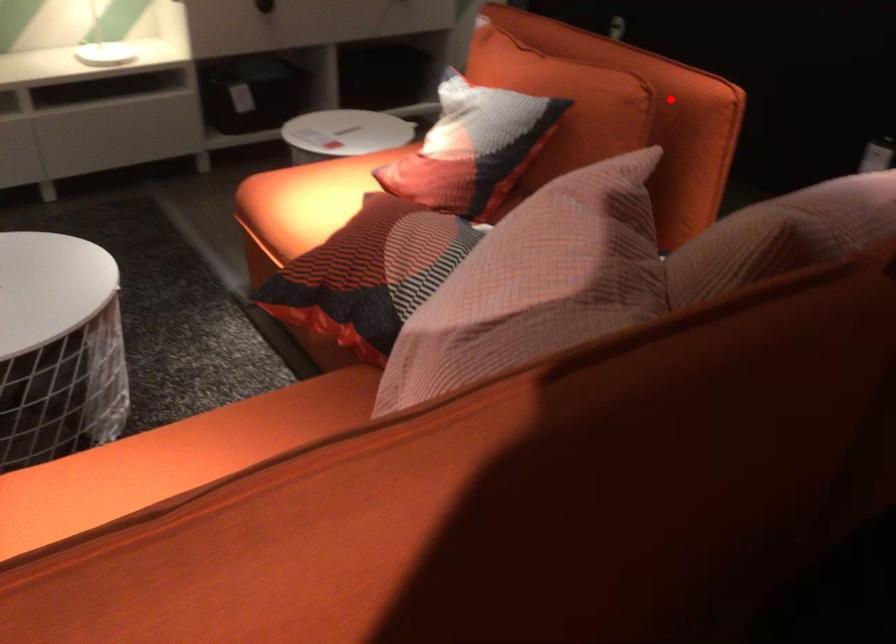
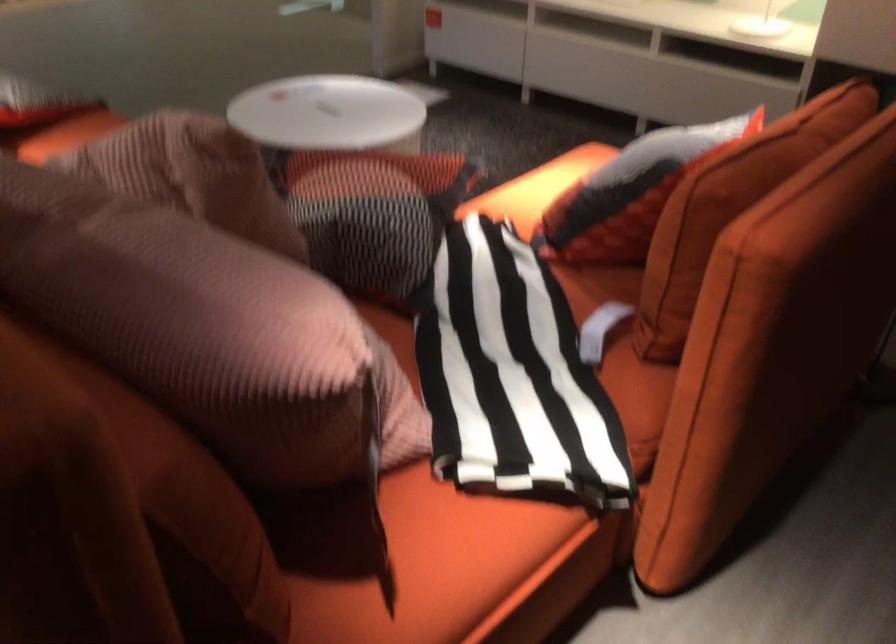
In the second image, find the point that corresponds to the highlighted location in the first image.

(730, 207)